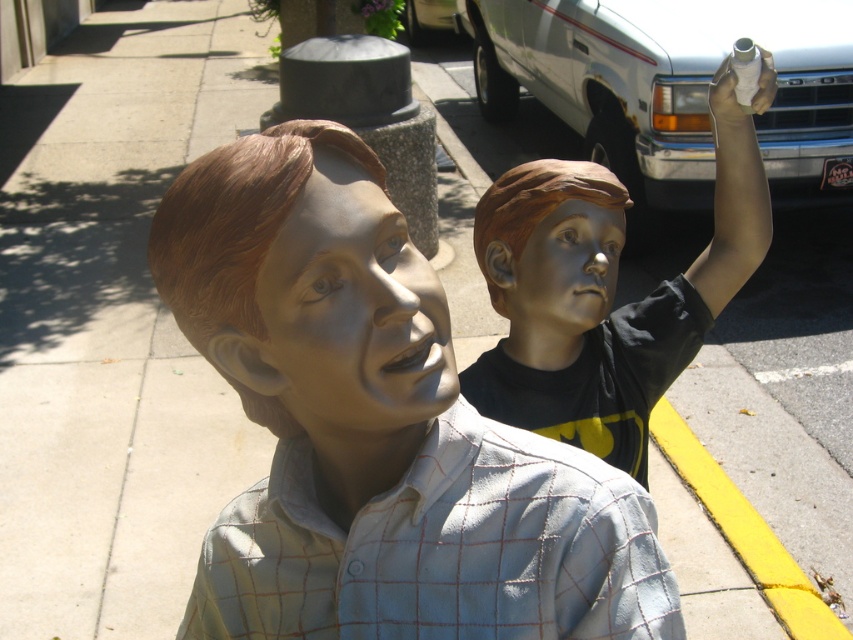
You are standing at the center of the sidewalk and want to take a photo of the statue represented by point (602, 294). Which direction should you move to face it?

The statue represented by point (602, 294) is located at the right side of the scene, so you should move to your right to face it.

Looking at this image, you are a pedestrian walking along the sidewalk and want to take a photo of both the matte bronze statue at right and the blue metallic face at center. Which statue should you stand closer to in order to capture both in your camera frame?

You should stand closer to the blue metallic face at center because the matte bronze statue at right is located above it, so positioning yourself closer to the lower one allows both to be in the frame.

You are a city planner assessing statues for a new public space. The matte bronze statue at right and the smooth silver face at center are under consideration. Based on their sizes, which statue would require a larger base to remain stable?

The matte bronze statue at right is much taller than the smooth silver face at center, so it would require a larger base to remain stable.